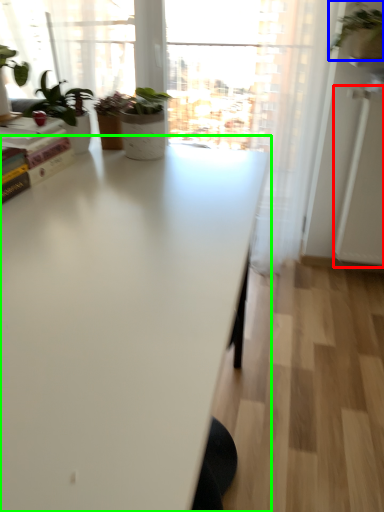
Question: Considering the real-world distances, which object is farthest from screen door (highlighted by a red box)? houseplant (highlighted by a blue box) or table (highlighted by a green box)?

Choices:
 (A) houseplant
 (B) table

Answer: (B)